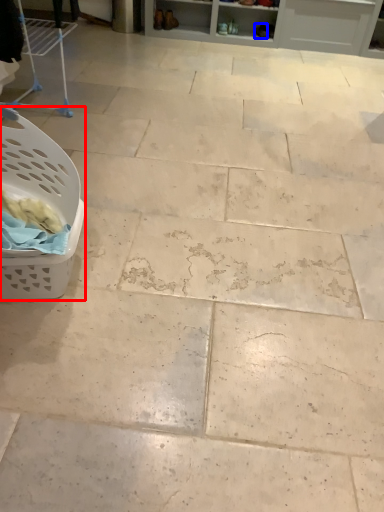
Question: Which of the following is the closest to the observer, basket (highlighted by a red box) or footwear (highlighted by a blue box)?

Choices:
 (A) basket
 (B) footwear

Answer: (A)